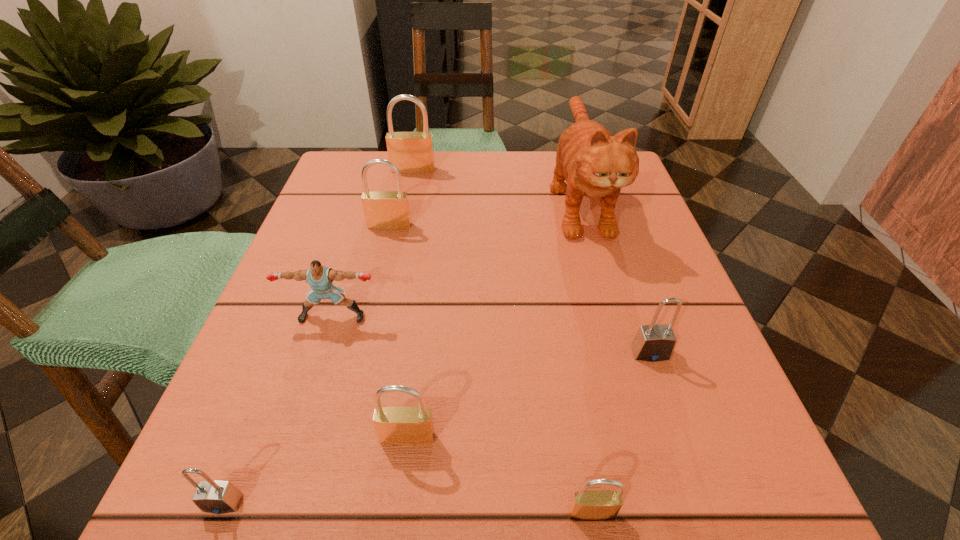
Locate an element on the screen. This screenshot has width=960, height=540. empty location between the bigger gray padlock and the fourth farthest padlock is located at coordinates (529, 395).

Identify the location of vacant space that is in between the tallest padlock and the sixth object from left to right. (502, 341).

Identify the location of unoccupied position between the leftmost padlock and the farthest padlock. (318, 336).

This screenshot has width=960, height=540. I want to click on free space between the orange cat and the farthest brass padlock, so click(496, 185).

Identify which object is located as the fourth nearest to the farthest padlock. Please provide its 2D coordinates. Your answer should be formatted as a tuple, i.e. [(x, y)], where the tuple contains the x and y coordinates of a point satisfying the conditions above.

[(654, 342)]

This screenshot has height=540, width=960. I want to click on the fourth closest object to the biggest brass padlock, so click(654, 342).

Identify which padlock is the fifth nearest to the puncher. Please provide its 2D coordinates. Your answer should be formatted as a tuple, i.e. [(x, y)], where the tuple contains the x and y coordinates of a point satisfying the conditions above.

[(654, 342)]

The image size is (960, 540). What are the coordinates of `the fourth closest padlock to the smallest brass padlock` in the screenshot? It's located at (388, 210).

Locate an element on the screen. the third closest brass padlock to the second padlock from right to left is located at coordinates (411, 152).

At what (x,y) coordinates should I click in order to perform the action: click on brass padlock that is the fourth closest one to the leftmost padlock. Please return your answer as a coordinate pair (x, y). This screenshot has height=540, width=960. Looking at the image, I should click on (411, 152).